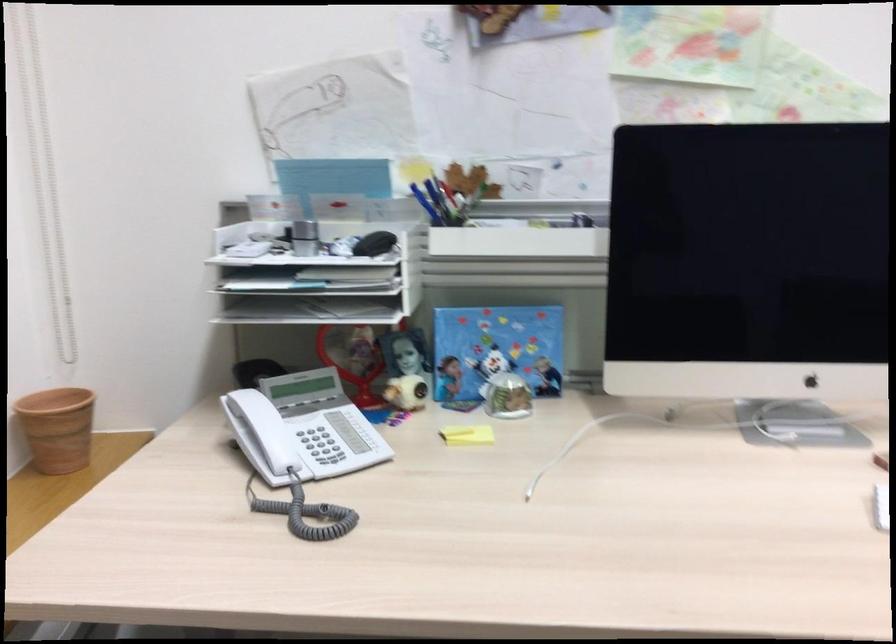
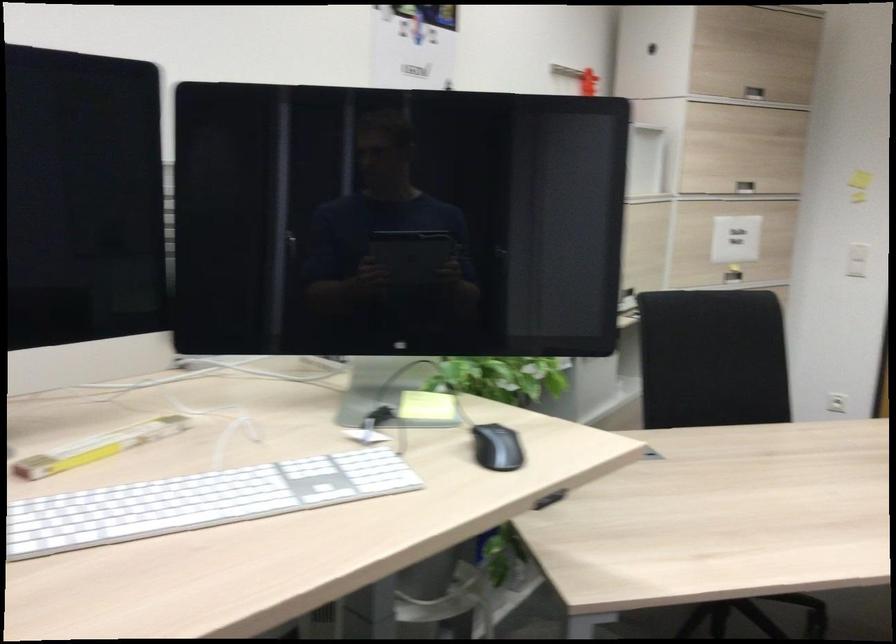
Question: The camera is either moving clockwise (left) or counter-clockwise (right) around the object. The first image is from the beginning of the video and the second image is from the end. Is the camera moving left or right when shooting the video?

Choices:
 (A) Left
 (B) Right

Answer: (A)